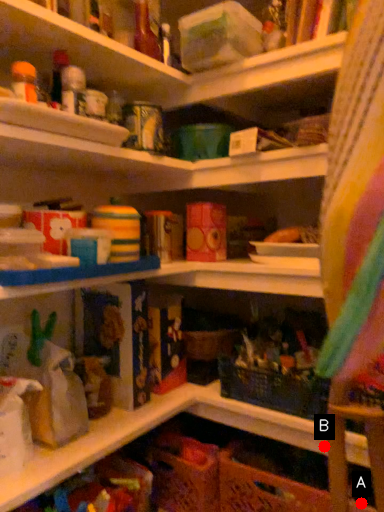
Question: Two points are circled on the image, labeled by A and B beside each circle. Which point is closer to the camera?

Choices:
 (A) A is closer
 (B) B is closer

Answer: (A)